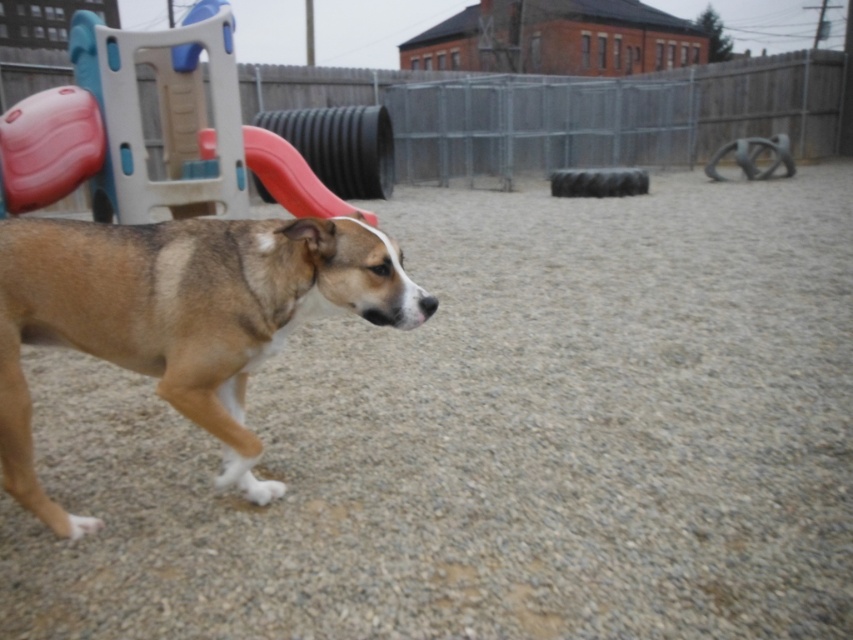
Question: Which point is closer to the camera?

Choices:
 (A) gray gravel at lower left
 (B) rubber tire at center
 (C) rubberized plastic slide at upper left

Answer: (A)

Question: Does gray gravel at lower left appear over brown fur dog at center?

Choices:
 (A) yes
 (B) no

Answer: (B)

Question: Considering the relative positions of gray gravel at lower left and brown fur dog at center in the image provided, where is gray gravel at lower left located with respect to brown fur dog at center?

Choices:
 (A) right
 (B) left

Answer: (A)

Question: Among these objects, which one is farthest from the camera?

Choices:
 (A) brown fur dog at center
 (B) rubber tire at center
 (C) gray gravel at lower left

Answer: (B)

Question: Which of these objects is positioned farthest from the gray gravel at lower left?

Choices:
 (A) brown fur dog at center
 (B) rubberized plastic slide at upper left
 (C) matte plastic slide at upper left
 (D) rubber tire at center

Answer: (D)

Question: Can you confirm if gray gravel at lower left is positioned above rubberized plastic slide at upper left?

Choices:
 (A) no
 (B) yes

Answer: (A)